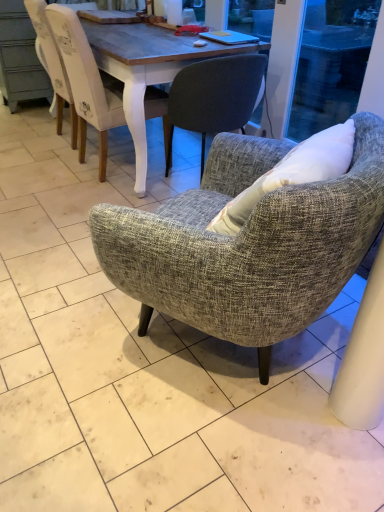
Image resolution: width=384 pixels, height=512 pixels. What do you see at coordinates (214, 97) in the screenshot?
I see `textured gray armchair at center, which ranks as the second chair in front-to-back order` at bounding box center [214, 97].

Where is `textured gray armchair at center, the first chair in the front-to-back sequence`? The width and height of the screenshot is (384, 512). textured gray armchair at center, the first chair in the front-to-back sequence is located at coordinates (248, 243).

At what (x,y) coordinates should I click in order to perform the action: click on textured gray armchair at center, the 2th chair when ordered from back to front. Please return your answer as a coordinate pair (x, y). The width and height of the screenshot is (384, 512). Looking at the image, I should click on (214, 97).

From a real-world perspective, which is physically below, white painted wood chair at upper left, the 3th chair in the front-to-back sequence, or textured gray armchair at center, the first chair in the front-to-back sequence?

In real-world perspective, white painted wood chair at upper left, the 3th chair in the front-to-back sequence, is lower.

From the image's perspective, is white painted wood chair at upper left, which is the first chair in back-to-front order, located above textured gray armchair at center, the 3th chair when ordered from back to front?

Correct, white painted wood chair at upper left, which is the first chair in back-to-front order, appears higher than textured gray armchair at center, the 3th chair when ordered from back to front, in the image.

Between white painted wood chair at upper left, which is the first chair in back-to-front order, and textured gray armchair at center, the first chair in the front-to-back sequence, which one is positioned behind?

white painted wood chair at upper left, which is the first chair in back-to-front order, is more distant.

Considering the sizes of white painted wood chair at upper left, which is the first chair in back-to-front order, and textured gray armchair at center, which ranks as the second chair in front-to-back order, in the image, is white painted wood chair at upper left, which is the first chair in back-to-front order, wider or thinner than textured gray armchair at center, which ranks as the second chair in front-to-back order,?

white painted wood chair at upper left, which is the first chair in back-to-front order, is wider than textured gray armchair at center, which ranks as the second chair in front-to-back order.

What's the angular difference between white painted wood chair at upper left, which is the first chair in back-to-front order, and textured gray armchair at center, the 2th chair when ordered from back to front,'s facing directions?

They differ by 90 degrees in their facing directions.

Could you tell me if white painted wood chair at upper left, the 3th chair in the front-to-back sequence, is turned towards textured gray armchair at center, which ranks as the second chair in front-to-back order?

No, white painted wood chair at upper left, the 3th chair in the front-to-back sequence, is not aimed at textured gray armchair at center, which ranks as the second chair in front-to-back order.

Is white painted wood chair at upper left, the 3th chair in the front-to-back sequence, next to textured gray armchair at center, which ranks as the second chair in front-to-back order, and touching it?

white painted wood chair at upper left, the 3th chair in the front-to-back sequence, and textured gray armchair at center, which ranks as the second chair in front-to-back order, are clearly separated.

Is textured gray armchair at center, the first chair in the front-to-back sequence, facing towards textured gray armchair at center, the 2th chair when ordered from back to front?

No.

Can you confirm if textured gray armchair at center, the first chair in the front-to-back sequence, is wider than textured gray armchair at center, which ranks as the second chair in front-to-back order?

Incorrect, the width of textured gray armchair at center, the first chair in the front-to-back sequence, does not surpass that of textured gray armchair at center, which ranks as the second chair in front-to-back order.

Locate an element on the screen. Image resolution: width=384 pixels, height=512 pixels. the 1st chair counting from the left of the textured gray armchair at center, the first chair in the front-to-back sequence is located at coordinates (x=214, y=97).

Is textured gray armchair at center, the 2th chair when ordered from back to front, facing towards white painted wood chair at upper left, the 3th chair in the front-to-back sequence?

No, textured gray armchair at center, the 2th chair when ordered from back to front, is not oriented towards white painted wood chair at upper left, the 3th chair in the front-to-back sequence.

How different are the orientations of textured gray armchair at center, which ranks as the second chair in front-to-back order, and white painted wood chair at upper left, the 3th chair in the front-to-back sequence, in degrees?

90 degrees.

From a real-world perspective, between textured gray armchair at center, which ranks as the second chair in front-to-back order, and white painted wood chair at upper left, the 3th chair in the front-to-back sequence, who is vertically lower?

In real-world perspective, textured gray armchair at center, which ranks as the second chair in front-to-back order, is lower.

Is the surface of textured gray armchair at center, which ranks as the second chair in front-to-back order, in direct contact with white painted wood chair at upper left, which is the first chair in back-to-front order?

No, textured gray armchair at center, which ranks as the second chair in front-to-back order, is not with white painted wood chair at upper left, which is the first chair in back-to-front order.

Considering the relative positions of textured gray armchair at center, the 2th chair when ordered from back to front, and textured gray armchair at center, the first chair in the front-to-back sequence, in the image provided, is textured gray armchair at center, the 2th chair when ordered from back to front, to the left or to the right of textured gray armchair at center, the first chair in the front-to-back sequence,?

textured gray armchair at center, the 2th chair when ordered from back to front, is to the left of textured gray armchair at center, the first chair in the front-to-back sequence.

Is textured gray armchair at center, the 2th chair when ordered from back to front, touching textured gray armchair at center, the first chair in the front-to-back sequence?

textured gray armchair at center, the 2th chair when ordered from back to front, and textured gray armchair at center, the first chair in the front-to-back sequence, are clearly separated.

Which object is thinner, textured gray armchair at center, the 2th chair when ordered from back to front, or textured gray armchair at center, the 3th chair when ordered from back to front?

Thinner between the two is textured gray armchair at center, the 3th chair when ordered from back to front.

From a real-world perspective, is textured gray armchair at center, which ranks as the second chair in front-to-back order, positioned above or below textured gray armchair at center, the 3th chair when ordered from back to front?

textured gray armchair at center, which ranks as the second chair in front-to-back order, is situated lower than textured gray armchair at center, the 3th chair when ordered from back to front, in the real world.

Between textured gray armchair at center, the first chair in the front-to-back sequence, and white painted wood chair at upper left, the 3th chair in the front-to-back sequence, which one has smaller width?

With smaller width is textured gray armchair at center, the first chair in the front-to-back sequence.

Is textured gray armchair at center, the first chair in the front-to-back sequence, oriented towards white painted wood chair at upper left, the 3th chair in the front-to-back sequence?

No.

Is textured gray armchair at center, the first chair in the front-to-back sequence, not near white painted wood chair at upper left, which is the first chair in back-to-front order?

That's right, there is a large distance between textured gray armchair at center, the first chair in the front-to-back sequence, and white painted wood chair at upper left, which is the first chair in back-to-front order.

Find the location of a particular element. The image size is (384, 512). the 2nd chair above the textured gray armchair at center, the 3th chair when ordered from back to front (from the image's perspective) is located at coordinates pyautogui.click(x=87, y=83).

This screenshot has height=512, width=384. Find the location of `chair below the white painted wood chair at upper left, which is the first chair in back-to-front order (from a real-world perspective)`. chair below the white painted wood chair at upper left, which is the first chair in back-to-front order (from a real-world perspective) is located at coordinates (214, 97).

Which object lies nearer to the anchor point white painted wood chair at upper left, which is the first chair in back-to-front order, textured gray armchair at center, the 2th chair when ordered from back to front, or textured gray armchair at center, the first chair in the front-to-back sequence?

Among the two, textured gray armchair at center, the 2th chair when ordered from back to front, is located nearer to white painted wood chair at upper left, which is the first chair in back-to-front order.

Looking at the image, which one is located closer to white painted wood chair at upper left, the 3th chair in the front-to-back sequence, textured gray armchair at center, the 3th chair when ordered from back to front, or textured gray armchair at center, which ranks as the second chair in front-to-back order?

textured gray armchair at center, which ranks as the second chair in front-to-back order.

Based on their spatial positions, is textured gray armchair at center, the 2th chair when ordered from back to front, or white painted wood chair at upper left, which is the first chair in back-to-front order, closer to textured gray armchair at center, the first chair in the front-to-back sequence?

The object closer to textured gray armchair at center, the first chair in the front-to-back sequence, is textured gray armchair at center, the 2th chair when ordered from back to front.

Which object lies nearer to the anchor point textured gray armchair at center, the 3th chair when ordered from back to front, white painted wood chair at upper left, the 3th chair in the front-to-back sequence, or textured gray armchair at center, the 2th chair when ordered from back to front?

textured gray armchair at center, the 2th chair when ordered from back to front.

Considering their positions, is white painted wood chair at upper left, the 3th chair in the front-to-back sequence, positioned closer to textured gray armchair at center, the 2th chair when ordered from back to front, than textured gray armchair at center, the first chair in the front-to-back sequence?

Based on the image, white painted wood chair at upper left, the 3th chair in the front-to-back sequence, appears to be nearer to textured gray armchair at center, the 2th chair when ordered from back to front.

Estimate the real-world distances between objects in this image. Which object is further from textured gray armchair at center, which ranks as the second chair in front-to-back order, textured gray armchair at center, the 3th chair when ordered from back to front, or white painted wood chair at upper left, which is the first chair in back-to-front order?

textured gray armchair at center, the 3th chair when ordered from back to front, is further to textured gray armchair at center, which ranks as the second chair in front-to-back order.

This screenshot has height=512, width=384. In order to click on chair between textured gray armchair at center, the 3th chair when ordered from back to front, and white painted wood chair at upper left, which is the first chair in back-to-front order, along the z-axis in this screenshot , I will do `click(214, 97)`.